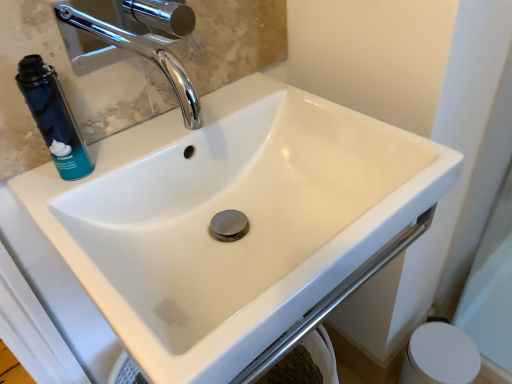
Question: Considering the relative sizes of white matte toilet paper at lower right and blue matte can at upper left in the image provided, is white matte toilet paper at lower right thinner than blue matte can at upper left?

Choices:
 (A) yes
 (B) no

Answer: (B)

Question: Can you confirm if white matte toilet paper at lower right is shorter than blue matte can at upper left?

Choices:
 (A) yes
 (B) no

Answer: (B)

Question: From the image's perspective, is white matte toilet paper at lower right over blue matte can at upper left?

Choices:
 (A) yes
 (B) no

Answer: (B)

Question: Considering the relative positions of white matte toilet paper at lower right and blue matte can at upper left in the image provided, is white matte toilet paper at lower right behind blue matte can at upper left?

Choices:
 (A) no
 (B) yes

Answer: (B)

Question: From the image's perspective, is white matte toilet paper at lower right beneath blue matte can at upper left?

Choices:
 (A) no
 (B) yes

Answer: (B)

Question: Is white matte toilet paper at lower right next to blue matte can at upper left?

Choices:
 (A) no
 (B) yes

Answer: (A)

Question: Is blue matte can at upper left far from matte glass mirror at upper left?

Choices:
 (A) no
 (B) yes

Answer: (A)

Question: Does blue matte can at upper left turn towards matte glass mirror at upper left?

Choices:
 (A) yes
 (B) no

Answer: (B)

Question: From the image's perspective, does blue matte can at upper left appear higher than matte glass mirror at upper left?

Choices:
 (A) yes
 (B) no

Answer: (B)

Question: Does blue matte can at upper left have a smaller size compared to matte glass mirror at upper left?

Choices:
 (A) yes
 (B) no

Answer: (A)

Question: Is blue matte can at upper left oriented away from matte glass mirror at upper left?

Choices:
 (A) yes
 (B) no

Answer: (A)

Question: Is the position of blue matte can at upper left more distant than that of matte glass mirror at upper left?

Choices:
 (A) no
 (B) yes

Answer: (B)

Question: Could matte glass mirror at upper left be considered to be inside white matte toilet paper at lower right?

Choices:
 (A) yes
 (B) no

Answer: (B)